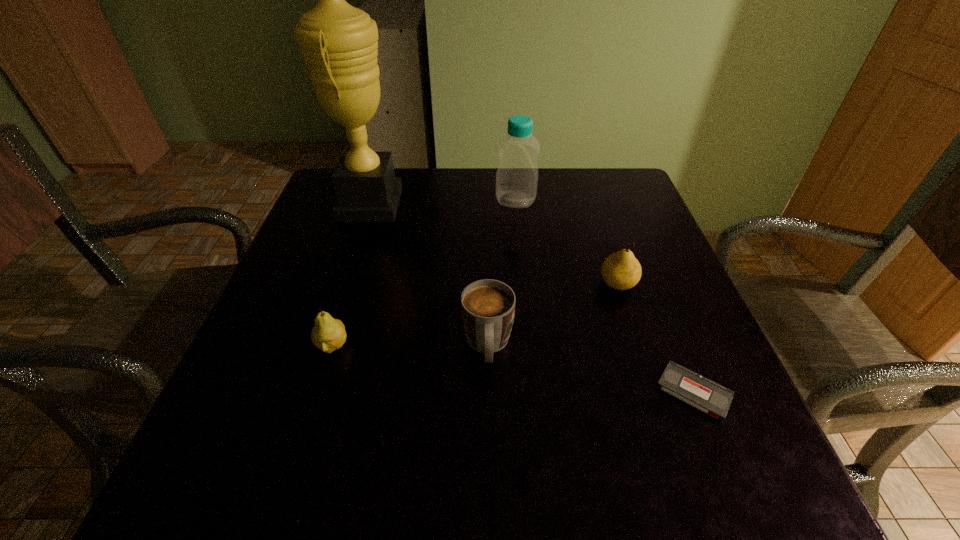
You are a GUI agent. You are given a task and a screenshot of the screen. Output one action in this format:
    pyautogui.click(x=<x>, y=<y>)
    Task: Click on the free spot between the left pear and the mug
    
    Given the screenshot: What is the action you would take?
    pyautogui.click(x=410, y=346)

Locate an element on the screen. This screenshot has width=960, height=540. free space between the fourth nearest object and the bottle is located at coordinates (566, 242).

This screenshot has height=540, width=960. I want to click on unoccupied position between the mug and the tallest object, so click(429, 275).

The width and height of the screenshot is (960, 540). I want to click on empty space between the fifth shortest object and the trophy cup, so click(443, 202).

In order to click on free space between the mug and the fifth shortest object in this screenshot , I will do `click(502, 273)`.

Find the location of a particular element. This screenshot has width=960, height=540. object that is the second closest to the bottle is located at coordinates (621, 270).

Identify which object is the fourth closest to the videotape. Please provide its 2D coordinates. Your answer should be formatted as a tuple, i.e. [(x, y)], where the tuple contains the x and y coordinates of a point satisfying the conditions above.

[(328, 334)]

Where is `free space in the image that satisfies the following two spatial constraints: 1. at the front of the tallest object with handles; 2. on the left side of the left pear`? The width and height of the screenshot is (960, 540). free space in the image that satisfies the following two spatial constraints: 1. at the front of the tallest object with handles; 2. on the left side of the left pear is located at coordinates (324, 346).

Where is `free space that satisfies the following two spatial constraints: 1. on the back side of the shortest object; 2. at the front of the tallest object with handles`? free space that satisfies the following two spatial constraints: 1. on the back side of the shortest object; 2. at the front of the tallest object with handles is located at coordinates (618, 204).